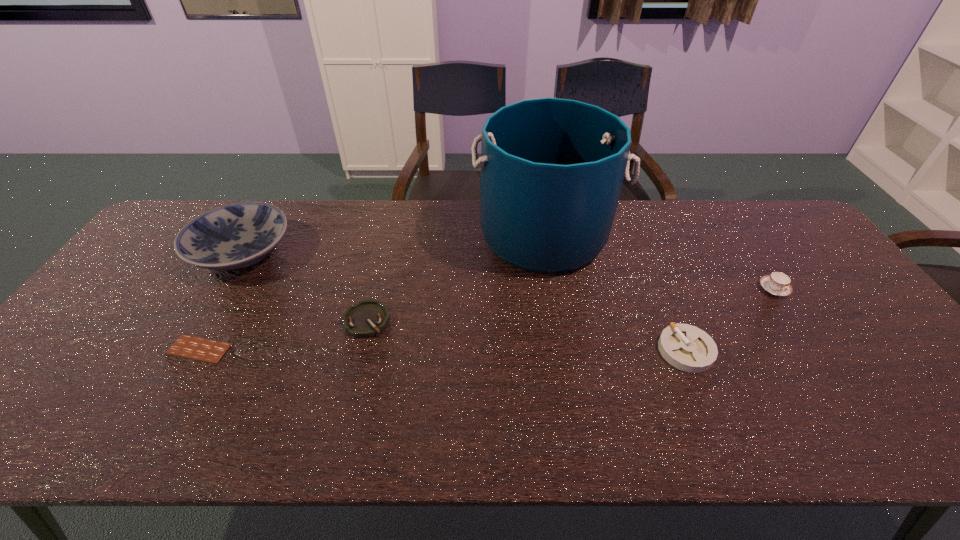
Image resolution: width=960 pixels, height=540 pixels. What are the coordinates of `free space located 0.230m on the left of the third object from right to left` in the screenshot? It's located at (400, 235).

Where is `vacant region located 0.130m on the front of the second tallest object`? The height and width of the screenshot is (540, 960). vacant region located 0.130m on the front of the second tallest object is located at coordinates (200, 322).

You are a GUI agent. You are given a task and a screenshot of the screen. Output one action in this format:
    pyautogui.click(x=<x>, y=<y>)
    Task: Click on the blank space located on the side with the handle of the fourth shortest object
    
    Given the screenshot: What is the action you would take?
    pyautogui.click(x=841, y=389)

The width and height of the screenshot is (960, 540). In order to click on free location located on the right of the taller ashtray in this screenshot , I will do `click(757, 350)`.

Locate an element on the screen. The height and width of the screenshot is (540, 960). free space located on the left of the shorter ashtray is located at coordinates (218, 321).

Locate an element on the screen. Image resolution: width=960 pixels, height=540 pixels. vacant space located 0.210m on the front of the shortest object is located at coordinates (142, 449).

Image resolution: width=960 pixels, height=540 pixels. What are the coordinates of `bucket that is at the far edge` in the screenshot? It's located at (552, 169).

Where is `plate at the far edge`? Image resolution: width=960 pixels, height=540 pixels. plate at the far edge is located at coordinates (234, 236).

I want to click on object that is at the left edge, so click(x=234, y=236).

In order to click on object located in the far left corner section of the desktop in this screenshot , I will do `click(234, 236)`.